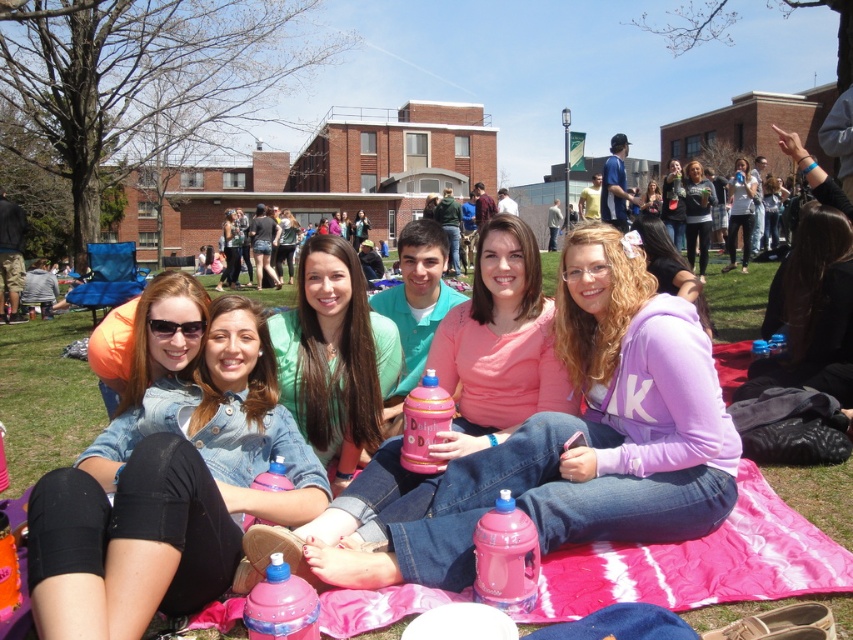
Is pink matte water bottle at center further to camera compared to pink plastic water bottle at lower center?

Yes, it is behind pink plastic water bottle at lower center.

Is pink matte water bottle at center below pink plastic water bottle at lower center?

No.

This screenshot has height=640, width=853. Find the location of `pink matte water bottle at center`. pink matte water bottle at center is located at coordinates (585, 435).

From the picture: Can you confirm if pink plastic bottle at center is thinner than matte white hoodie at upper right?

Indeed, pink plastic bottle at center has a lesser width compared to matte white hoodie at upper right.

What are the coordinates of `pink plastic bottle at center` in the screenshot? It's located at (424, 422).

Locate an element on the screen. The height and width of the screenshot is (640, 853). pink plastic bottle at center is located at coordinates (424, 422).

Is pink plastic water bottle at center positioned at the back of matte black jacket at upper right?

No, it is in front of matte black jacket at upper right.

Does pink plastic water bottle at center have a lesser width compared to matte black jacket at upper right?

Correct, pink plastic water bottle at center's width is less than matte black jacket at upper right's.

Does point (303, 595) come closer to viewer compared to point (671, 195)?

Yes, it is.

The height and width of the screenshot is (640, 853). In order to click on pink plastic water bottle at center in this screenshot , I will do `click(281, 605)`.